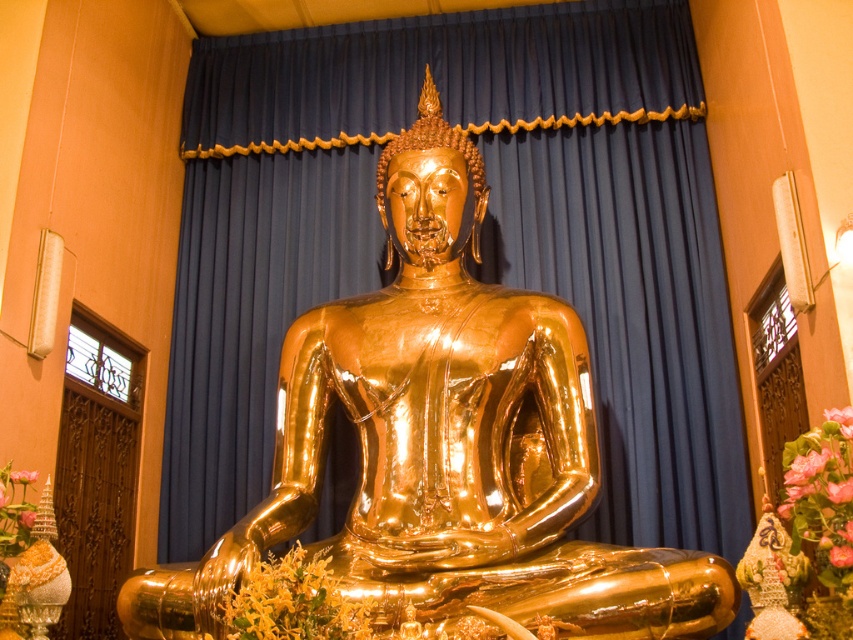
You are a visitor in a temple and see the golden Buddha statue. There are two pink flowers in the scene. One is a pink silk flower at center and the other is a pink floral bouquet at center. Which one is positioned higher?

The pink silk flower at center is positioned higher than the pink floral bouquet at center.